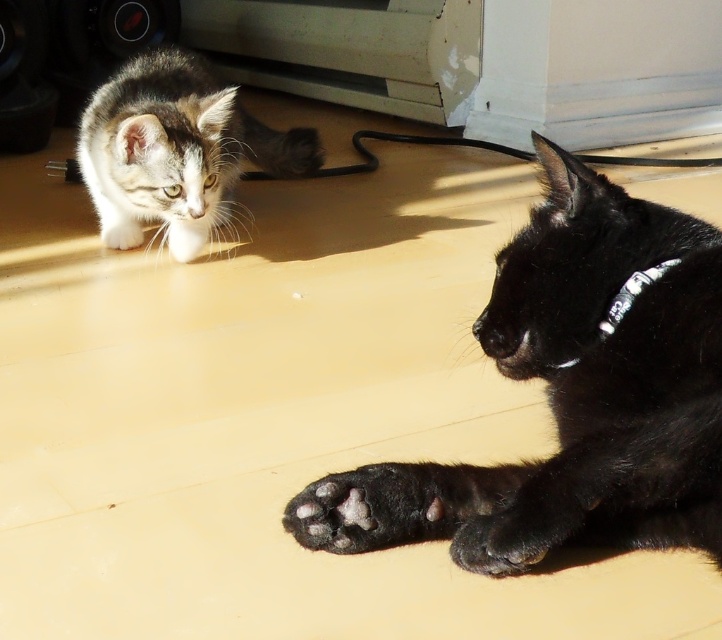
Looking at this image, you are a cat owner who wants to place a new toy between the white printed fabric at center and the black fabric neckband at lower right. Based on their positions, which object should you place the toy closer to if you want it to be near the higher one?

The white printed fabric at center is taller than the black fabric neckband at lower right, so you should place the toy closer to the white printed fabric at center.

You are standing in the room and want to reach the two points marked in the image. Which point, point (432, 493) or point (652, 266), is closer to you?

Point (432, 493) is closer to the viewer than point (652, 266).

You are a photographer trying to capture a clear image of the white fur paw at center. However, the white printed fabric at center is blocking your view. Can you move the fabric to the side so that the paw becomes visible?

The white printed fabric at center is in front of the white fur paw at center, so moving the fabric to the side would allow the paw to become visible.